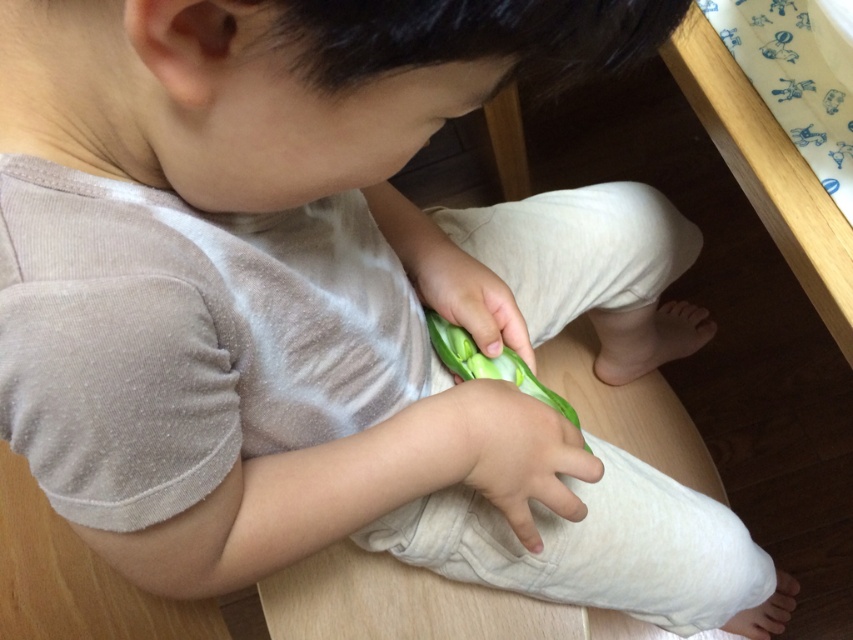
Does green matte flower at center appear over white soft hand at lower right?

Yes, green matte flower at center is above white soft hand at lower right.

Which is more to the left, green matte flower at center or white soft hand at lower right?

green matte flower at center

Which is in front, point (485, 291) or point (741, 630)?

Point (485, 291) is in front.

The width and height of the screenshot is (853, 640). Find the location of `green matte flower at center`. green matte flower at center is located at coordinates (466, 294).

At what (x,y) coordinates should I click in order to perform the action: click on green rubber toy at center. Please return your answer as a coordinate pair (x, y). Looking at the image, I should click on (515, 452).

Measure the distance between point (543, 483) and camera.

They are 22.61 inches apart.

Locate an element on the screen. This screenshot has width=853, height=640. green rubber toy at center is located at coordinates 515,452.

Measure the distance from green rubber toy at center to white soft hand at lower right.

They are 24.05 inches apart.

Is green rubber toy at center shorter than white soft hand at lower right?

Incorrect, green rubber toy at center's height does not fall short of white soft hand at lower right's.

In order to click on green rubber toy at center in this screenshot , I will do `click(515, 452)`.